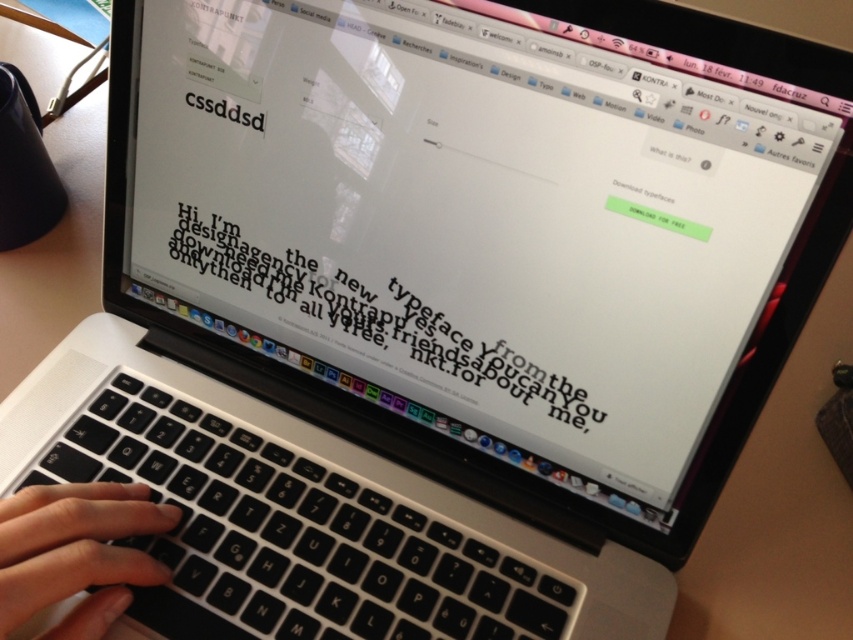
Question: Does white paper text at center have a greater width compared to black matte hand at center?

Choices:
 (A) yes
 (B) no

Answer: (A)

Question: Based on their relative distances, which object is nearer to the black matte keyboard at center?

Choices:
 (A) black matte hand at center
 (B) white paper text at center

Answer: (A)

Question: Which is farther from the white paper text at center?

Choices:
 (A) black matte keyboard at center
 (B) black matte hand at center

Answer: (B)

Question: Considering the real-world distances, which object is closest to the white paper text at center?

Choices:
 (A) black matte hand at center
 (B) black matte keyboard at center

Answer: (B)

Question: Is black matte keyboard at center smaller than white paper text at center?

Choices:
 (A) yes
 (B) no

Answer: (B)

Question: Where is white paper text at center located in relation to black matte hand at center in the image?

Choices:
 (A) right
 (B) left

Answer: (A)